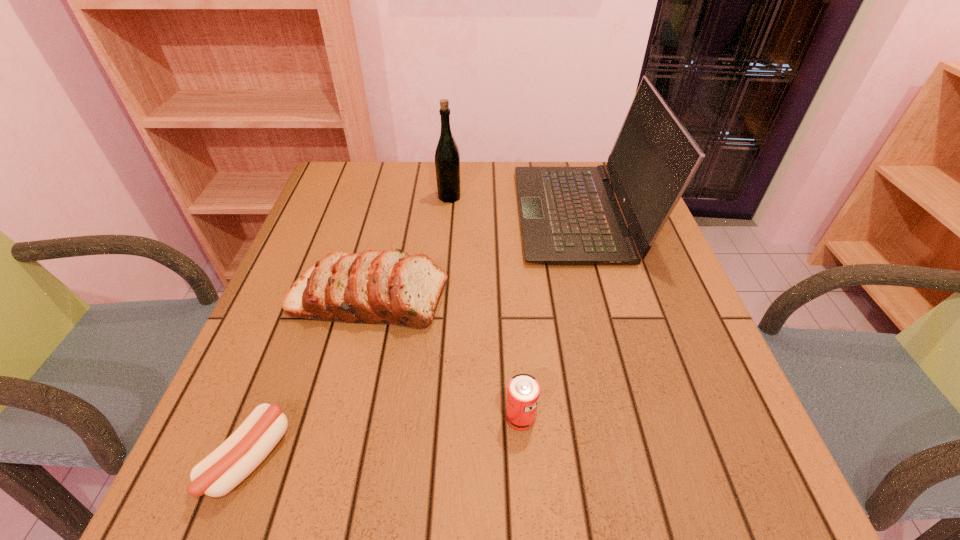
This screenshot has height=540, width=960. In the image, there is a desktop. Find the location of `vacant area at the far edge`. vacant area at the far edge is located at coordinates (540, 162).

In the image, there is a desktop. Find the location of `vacant space at the near edge`. vacant space at the near edge is located at coordinates (612, 496).

In the image, there is a desktop. At what (x,y) coordinates should I click in order to perform the action: click on free space at the left edge. Please return your answer as a coordinate pair (x, y). Image resolution: width=960 pixels, height=540 pixels. Looking at the image, I should click on (321, 219).

This screenshot has height=540, width=960. I want to click on vacant space at the right edge, so click(638, 356).

Find the location of a particular element. Image resolution: width=960 pixels, height=540 pixels. vacant region at the far left corner of the desktop is located at coordinates (329, 178).

I want to click on vacant space that is in between the second object from right to left and the laptop computer, so click(550, 316).

Locate an element on the screen. vacant space that is in between the laptop computer and the beer bottle is located at coordinates (515, 206).

At what (x,y) coordinates should I click in order to perform the action: click on free space between the shortest object and the can. Please return your answer as a coordinate pair (x, y). The image size is (960, 540). Looking at the image, I should click on (385, 438).

The width and height of the screenshot is (960, 540). What are the coordinates of `blank region between the can and the shortest object` in the screenshot? It's located at (385, 438).

The width and height of the screenshot is (960, 540). I want to click on empty space that is in between the beer bottle and the third farthest object, so point(409,248).